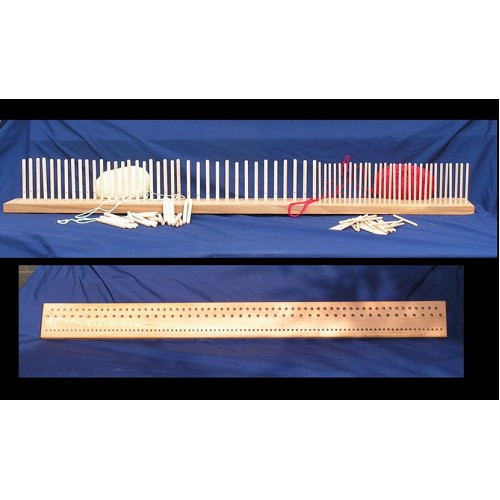
This screenshot has height=500, width=500. Find the location of `peg`. peg is located at coordinates (23, 182), (44, 180), (62, 183), (171, 180), (208, 183), (265, 188), (323, 182), (460, 180), (369, 183).